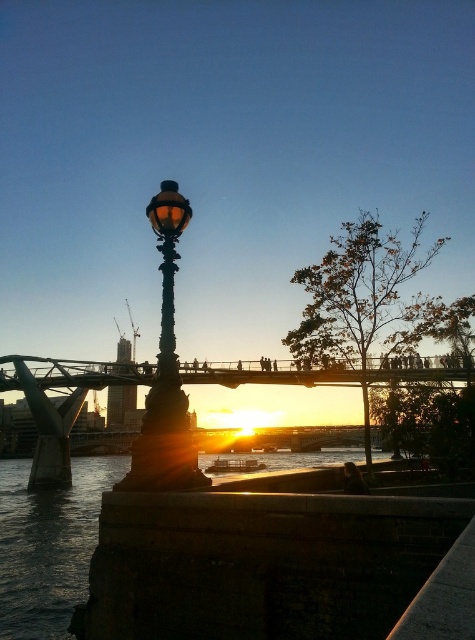
Question: Which of the following is the farthest from the observer?

Choices:
 (A) metallic bridge at center
 (B) matte black street light at center

Answer: (A)

Question: Observing the image, what is the correct spatial positioning of metallic bridge at center in reference to matte black street light at center?

Choices:
 (A) above
 (B) below

Answer: (B)

Question: Is metallic bridge at center thinner than matte black street light at center?

Choices:
 (A) yes
 (B) no

Answer: (B)

Question: Is metallic bridge at center to the right of matte black street light at center from the viewer's perspective?

Choices:
 (A) yes
 (B) no

Answer: (B)